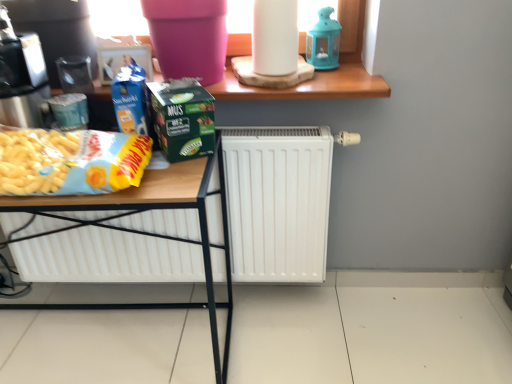
What do you see at coordinates (308, 86) in the screenshot?
I see `wooden at upper center` at bounding box center [308, 86].

What do you see at coordinates (275, 37) in the screenshot? The height and width of the screenshot is (384, 512). I see `white matte paper towel at upper center` at bounding box center [275, 37].

What is the approximate height of metallic silver coffee machine at left?

14.28 inches.

The width and height of the screenshot is (512, 384). Find the location of `wooden at upper center`. wooden at upper center is located at coordinates (308, 86).

Which object is further away from the camera taking this photo, white matte paper towel at upper center or blue glass lantern at upper center?

blue glass lantern at upper center.

Considering the relative positions of white matte paper towel at upper center and blue glass lantern at upper center in the image provided, is white matte paper towel at upper center to the left or to the right of blue glass lantern at upper center?

In the image, white matte paper towel at upper center appears on the left side of blue glass lantern at upper center.

Considering the sizes of objects white matte radiator at center and matte plastic table at center in the image provided, who is shorter, white matte radiator at center or matte plastic table at center?

With less height is white matte radiator at center.

Does white matte radiator at center appear on the right side of matte plastic table at center?

Yes.

Is white matte radiator at center aimed at matte plastic table at center?

Yes, white matte radiator at center is aimed at matte plastic table at center.

Is white matte radiator at center oriented away from blue glass lantern at upper center?

white matte radiator at center is not turned away from blue glass lantern at upper center.

How many degrees apart are the facing directions of white matte radiator at center and blue glass lantern at upper center?

They differ by 1.61 degrees in their facing directions.

Measure the distance from white matte radiator at center to blue glass lantern at upper center.

The distance of white matte radiator at center from blue glass lantern at upper center is 26.79 inches.

Considering the sizes of white matte radiator at center and blue glass lantern at upper center in the image, is white matte radiator at center wider or thinner than blue glass lantern at upper center?

Considering their sizes, white matte radiator at center looks slimmer than blue glass lantern at upper center.

From the image's perspective, is metallic silver coffee machine at left on blue glass lantern at upper center?

Actually, metallic silver coffee machine at left appears below blue glass lantern at upper center in the image.

Which of these two, metallic silver coffee machine at left or blue glass lantern at upper center, is thinner?

With smaller width is blue glass lantern at upper center.

Identify the location of coffee machine that is in front of the blue glass lantern at upper center. Image resolution: width=512 pixels, height=384 pixels. (21, 76).

Is metallic silver coffee machine at left not near green matte carton at center?

That's not correct — metallic silver coffee machine at left is a little close to green matte carton at center.

Between point (11, 39) and point (186, 146), which one is positioned behind?

The point (186, 146) is farther from the camera.

From a real-world perspective, which is physically below, metallic silver coffee machine at left or green matte carton at center?

From a 3D spatial view, green matte carton at center is below.

Visually, is metallic silver coffee machine at left positioned to the left or to the right of green matte carton at center?

metallic silver coffee machine at left is positioned on green matte carton at center's left side.

From the image's perspective, which object appears higher, white matte radiator at center or wooden at upper center?

From the image's view, wooden at upper center is above.

Is white matte radiator at center looking in the opposite direction of wooden at upper center?

No, wooden at upper center is not at the back of white matte radiator at center.

From a real-world perspective, which is physically below, white matte radiator at center or wooden at upper center?

white matte radiator at center is physically lower.

Between white matte radiator at center and wooden at upper center, which one appears on the right side from the viewer's perspective?

wooden at upper center is more to the right.

Does white matte paper towel at upper center have a larger size compared to wooden at upper center?

No.

Which object is positioned more to the right, white matte paper towel at upper center or wooden at upper center?

white matte paper towel at upper center.

You are a GUI agent. You are given a task and a screenshot of the screen. Output one action in this format:
    pyautogui.click(x=<x>, y=<y>)
    Task: Click on the window sill that appears below the white matte paper towel at upper center (from a real-world perspective)
    Image resolution: width=512 pixels, height=384 pixels.
    Given the screenshot: What is the action you would take?
    pyautogui.click(x=308, y=86)

Is white matte paper towel at upper center located outside wooden at upper center?

That's correct, white matte paper towel at upper center is outside of wooden at upper center.

I want to click on paper towel on the left side of blue glass lantern at upper center, so click(275, 37).

Locate an element on the screen. radiator above the matte plastic table at center (from a real-world perspective) is located at coordinates (278, 202).

Based on their spatial positions, is wooden at upper center or white matte paper towel at upper center closer to white matte radiator at center?

The object closer to white matte radiator at center is wooden at upper center.

Estimate the real-world distances between objects in this image. Which object is further from blue glass lantern at upper center, white matte radiator at center or matte plastic table at center?

Among the two, matte plastic table at center is located further to blue glass lantern at upper center.

When comparing their distances from white matte radiator at center, does wooden at upper center or blue glass lantern at upper center seem closer?

Based on the image, wooden at upper center appears to be nearer to white matte radiator at center.

Estimate the real-world distances between objects in this image. Which object is further from metallic silver coffee machine at left, wooden at upper center or white matte paper towel at upper center?

white matte paper towel at upper center lies further to metallic silver coffee machine at left than the other object.

When comparing their distances from white matte paper towel at upper center, does wooden at upper center or white matte radiator at center seem further?

white matte radiator at center is further to white matte paper towel at upper center.

Estimate the real-world distances between objects in this image. Which object is closer to blue glass lantern at upper center, wooden at upper center or matte plastic table at center?

wooden at upper center is closer to blue glass lantern at upper center.

When comparing their distances from metallic silver coffee machine at left, does green matte carton at center or white matte radiator at center seem closer?

green matte carton at center lies closer to metallic silver coffee machine at left than the other object.

Considering their positions, is green matte carton at center positioned closer to blue glass lantern at upper center than white matte radiator at center?

green matte carton at center lies closer to blue glass lantern at upper center than the other object.

Where is `radiator that lies between wooden at upper center and matte plastic table at center from top to bottom`? This screenshot has width=512, height=384. radiator that lies between wooden at upper center and matte plastic table at center from top to bottom is located at coordinates (278, 202).

Where is `radiator between metallic silver coffee machine at left and blue glass lantern at upper center in the horizontal direction`? The height and width of the screenshot is (384, 512). radiator between metallic silver coffee machine at left and blue glass lantern at upper center in the horizontal direction is located at coordinates (278, 202).

This screenshot has width=512, height=384. Find the location of `window sill between blue glass lantern at upper center and white matte radiator at center vertically`. window sill between blue glass lantern at upper center and white matte radiator at center vertically is located at coordinates (308, 86).

Where is `paper towel positioned between green matte carton at center and wooden at upper center from near to far`? paper towel positioned between green matte carton at center and wooden at upper center from near to far is located at coordinates (275, 37).